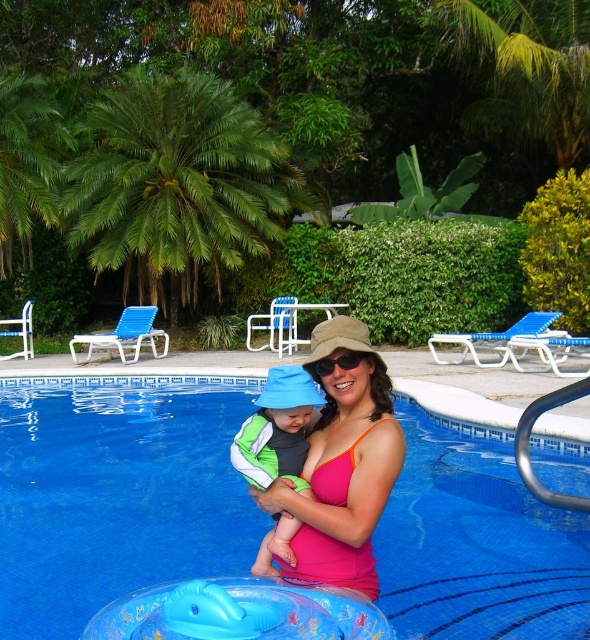
Question: Considering the real-world distances, which object is closest to the pink fabric at center?

Choices:
 (A) green fleece jacket at center
 (B) green leafy palm tree at upper center
 (C) blue plastic pool at center

Answer: (A)

Question: Is blue plastic pool at center to the left of green fleece jacket at center from the viewer's perspective?

Choices:
 (A) no
 (B) yes

Answer: (A)

Question: Which is nearer to the green fleece jacket at center?

Choices:
 (A) pink fabric at center
 (B) green leafy palm tree at upper center
 (C) blue plastic pool at center

Answer: (A)

Question: Is pink fabric at center above green leafy palm tree at upper center?

Choices:
 (A) yes
 (B) no

Answer: (B)

Question: Can you confirm if pink fabric at center is positioned to the right of green fleece jacket at center?

Choices:
 (A) no
 (B) yes

Answer: (B)

Question: Among these objects, which one is farthest from the camera?

Choices:
 (A) pink fabric at center
 (B) green leafy palm tree at upper center

Answer: (B)